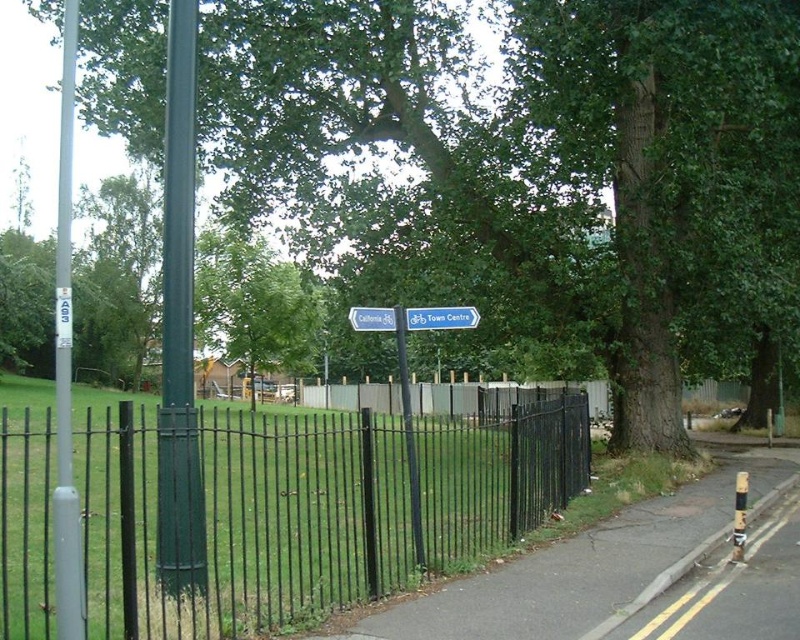
You are standing at the entrance of the park and see the black metal fence at center. If you walk straight ahead, will you stay within the park boundaries or exit onto the road?

The black metal fence at center is located at point (237,518), which suggests it is positioned in the foreground near the edge of the park. Since fences often mark boundaries, walking straight ahead towards the fence would likely lead you towards the road outside the park.

You are a cyclist approaching the black metal fence at center and the black asphalt pavement at lower right. Which object will you encounter first?

The black metal fence at center is in front of the black asphalt pavement at lower right, so you will encounter the black metal fence at center first.

You are a cyclist approaching the black metal fence at center and the metallic pole at center. You need to pass through the space between them. Can your bicycle fit through the gap?

The black metal fence at center might be wider than metallic pole at center, so the gap between them may not be wide enough for a bicycle to pass through safely. It is recommended to choose a different route or dismount and walk the bike around.